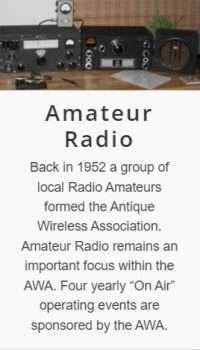
This screenshot has height=350, width=200. Find the location of `desk/table`. desk/table is located at coordinates (100, 81).